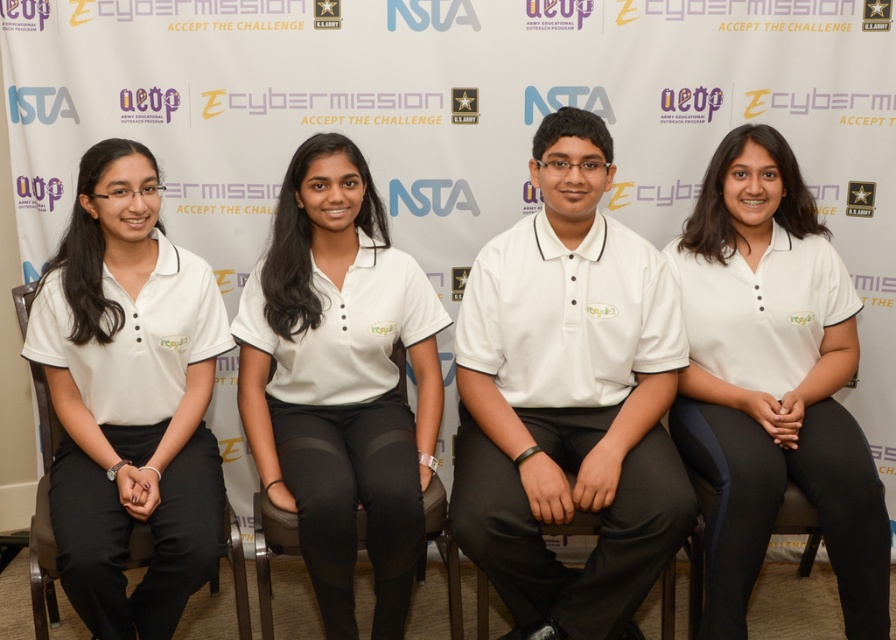
You are standing at the point labeled point (644, 394) and want to take a photo of the backdrop with your camera. If the camera is 2.15 meters away from you, will you be able to capture the entire backdrop in the photo?

The point labeled point (644, 394) and the camera are 2.15 meters apart. Since the distance between you and the camera matches the required distance to capture the entire backdrop, you should be able to capture the entire backdrop in the photo.

You are designing a uniform catalog for the Cyber Mission team. The catalog requires knowing which uniform item is wider. Which is wider, the white matte shirt at left or the white matte uniform at center?

The white matte uniform at center is wider than the white matte shirt at left.